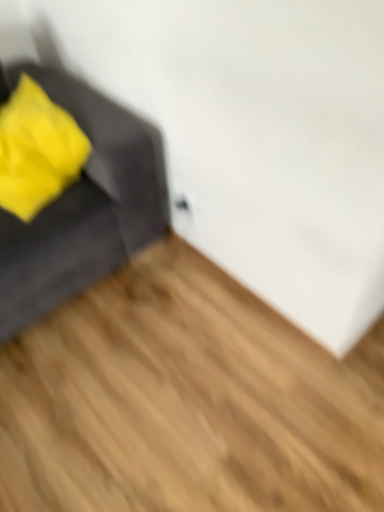
The width and height of the screenshot is (384, 512). Describe the element at coordinates (186, 401) in the screenshot. I see `light brown wood flooring at lower left` at that location.

Measure the distance between point (81, 503) and camera.

4.10 feet.

You are a GUI agent. You are given a task and a screenshot of the screen. Output one action in this format:
    pyautogui.click(x=<x>, y=<y>)
    Task: Click on the light brown wood flooring at lower left
    
    Given the screenshot: What is the action you would take?
    pyautogui.click(x=186, y=401)

Is velvet gray sofa at left outside of soft yellow fabric at left?

Yes, velvet gray sofa at left is located beyond the bounds of soft yellow fabric at left.

Locate an element on the screen. furniture located on the left of soft yellow fabric at left is located at coordinates (82, 207).

What's the angular difference between velvet gray sofa at left and soft yellow fabric at left's facing directions?

They differ by 0.603 degrees in their facing directions.

Considering the relative sizes of velvet gray sofa at left and soft yellow fabric at left in the image provided, is velvet gray sofa at left smaller than soft yellow fabric at left?

Actually, velvet gray sofa at left might be larger than soft yellow fabric at left.

Is light brown wood flooring at lower left outside of soft yellow fabric at left?

light brown wood flooring at lower left lies outside soft yellow fabric at left's area.

From the image's perspective, is light brown wood flooring at lower left positioned above or below soft yellow fabric at left?

Clearly, from the image's perspective, light brown wood flooring at lower left is below soft yellow fabric at left.

Between light brown wood flooring at lower left and soft yellow fabric at left, which one has smaller size?

soft yellow fabric at left.

Which of these two, light brown wood flooring at lower left or velvet gray sofa at left, is bigger?

With larger size is velvet gray sofa at left.

You are a GUI agent. You are given a task and a screenshot of the screen. Output one action in this format:
    pyautogui.click(x=<x>, y=<y>)
    Task: Click on the furniture above the light brown wood flooring at lower left (from the image's perspective)
    
    Given the screenshot: What is the action you would take?
    pyautogui.click(x=82, y=207)

Which is more to the left, light brown wood flooring at lower left or velvet gray sofa at left?

velvet gray sofa at left is more to the left.

From the picture: From the image's perspective, who appears lower, soft yellow fabric at left or light brown wood flooring at lower left?

light brown wood flooring at lower left is shown below in the image.

Looking at this image, is soft yellow fabric at left positioned with its back to light brown wood flooring at lower left?

No, soft yellow fabric at left is not facing the opposite direction of light brown wood flooring at lower left.

Does soft yellow fabric at left lie behind light brown wood flooring at lower left?

Yes, soft yellow fabric at left is further from the camera.

Is soft yellow fabric at left not inside light brown wood flooring at lower left?

Absolutely, soft yellow fabric at left is external to light brown wood flooring at lower left.

Is light brown wood flooring at lower left at the back of velvet gray sofa at left?

No, light brown wood flooring at lower left is not at the back of velvet gray sofa at left.

From the image's perspective, which object appears higher, velvet gray sofa at left or light brown wood flooring at lower left?

velvet gray sofa at left.

Is velvet gray sofa at left shorter than light brown wood flooring at lower left?

Incorrect, the height of velvet gray sofa at left does not fall short of that of light brown wood flooring at lower left.

Is velvet gray sofa at left next to light brown wood flooring at lower left and touching it?

velvet gray sofa at left and light brown wood flooring at lower left are clearly separated.

Does soft yellow fabric at left lie behind velvet gray sofa at left?

Yes, soft yellow fabric at left is behind velvet gray sofa at left.

From a real-world perspective, is soft yellow fabric at left located beneath velvet gray sofa at left?

No, from a real-world perspective, soft yellow fabric at left is not beneath velvet gray sofa at left.

Locate an element on the screen. The width and height of the screenshot is (384, 512). furniture on the left of soft yellow fabric at left is located at coordinates (82, 207).

Where is `throw pillow above the velvet gray sofa at left (from the image's perspective)`? This screenshot has width=384, height=512. throw pillow above the velvet gray sofa at left (from the image's perspective) is located at coordinates (37, 150).

At what (x,y) coordinates should I click in order to perform the action: click on throw pillow above the light brown wood flooring at lower left (from a real-world perspective). Please return your answer as a coordinate pair (x, y). The height and width of the screenshot is (512, 384). Looking at the image, I should click on (37, 150).

Looking at the image, which one is located further to velvet gray sofa at left, light brown wood flooring at lower left or soft yellow fabric at left?

light brown wood flooring at lower left.

Which object lies further to the anchor point velvet gray sofa at left, soft yellow fabric at left or light brown wood flooring at lower left?

light brown wood flooring at lower left is positioned further to the anchor velvet gray sofa at left.

From the image, which object appears to be farther from light brown wood flooring at lower left, soft yellow fabric at left or velvet gray sofa at left?

The object further to light brown wood flooring at lower left is soft yellow fabric at left.

Based on the photo, which object lies further to the anchor point light brown wood flooring at lower left, velvet gray sofa at left or soft yellow fabric at left?

Among the two, soft yellow fabric at left is located further to light brown wood flooring at lower left.

Which object lies nearer to the anchor point soft yellow fabric at left, velvet gray sofa at left or light brown wood flooring at lower left?

velvet gray sofa at left is positioned closer to the anchor soft yellow fabric at left.

From the image, which object appears to be farther from soft yellow fabric at left, light brown wood flooring at lower left or velvet gray sofa at left?

Based on the image, light brown wood flooring at lower left appears to be further to soft yellow fabric at left.

Locate an element on the screen. The width and height of the screenshot is (384, 512). furniture between soft yellow fabric at left and light brown wood flooring at lower left vertically is located at coordinates (82, 207).